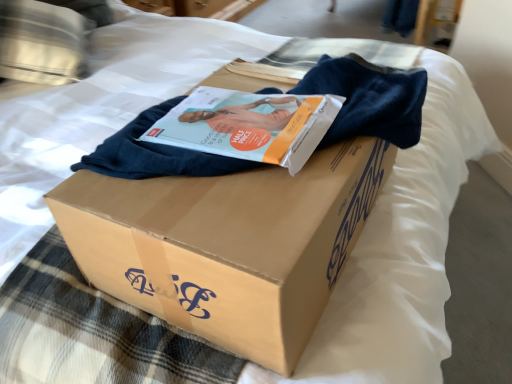
I want to click on matte paper magazine at center, so click(248, 125).

Is matte paper magazine at center completely or partially inside brown cardboard box at center?

Yes, matte paper magazine at center is inside brown cardboard box at center.

Is brown cardboard box at center to the right of matte paper magazine at center from the viewer's perspective?

Yes, brown cardboard box at center is to the right of matte paper magazine at center.

From the image's perspective, which one is positioned higher, brown cardboard box at center or matte paper magazine at center?

matte paper magazine at center.

Considering the points (57, 50) and (291, 326), which point is behind, point (57, 50) or point (291, 326)?

The point (57, 50) is behind.

Is the surface of metallic silver pillow at upper left in direct contact with brown cardboard box at center?

metallic silver pillow at upper left and brown cardboard box at center are clearly separated.

Between metallic silver pillow at upper left and brown cardboard box at center, which one has smaller size?

With smaller size is brown cardboard box at center.

I want to click on cardboard box above the metallic silver pillow at upper left (from a real-world perspective), so click(x=228, y=244).

Does metallic silver pillow at upper left have a greater height compared to matte paper magazine at center?

Yes, metallic silver pillow at upper left is taller than matte paper magazine at center.

Is metallic silver pillow at upper left not near matte paper magazine at center?

No, metallic silver pillow at upper left is in close proximity to matte paper magazine at center.

Can you tell me how much metallic silver pillow at upper left and matte paper magazine at center differ in facing direction?

They differ by 35.2 degrees in their facing directions.

From a real-world perspective, is matte paper magazine at center located higher than brown cardboard box at center?

Indeed, from a real-world perspective, matte paper magazine at center stands above brown cardboard box at center.

Where is `cardboard box on the right of matte paper magazine at center`? This screenshot has width=512, height=384. cardboard box on the right of matte paper magazine at center is located at coordinates (228, 244).

Is matte paper magazine at center not close to brown cardboard box at center?

No, there isn't a large distance between matte paper magazine at center and brown cardboard box at center.

From the image's perspective, which is above, matte paper magazine at center or brown cardboard box at center?

matte paper magazine at center appears higher in the image.

From the image's perspective, is matte paper magazine at center above or below metallic silver pillow at upper left?

From the image's perspective, matte paper magazine at center appears below metallic silver pillow at upper left.

What's the angular difference between matte paper magazine at center and metallic silver pillow at upper left's facing directions?

The angle between the facing direction of matte paper magazine at center and the facing direction of metallic silver pillow at upper left is 35.2 degrees.

Does matte paper magazine at center come behind metallic silver pillow at upper left?

No, matte paper magazine at center is in front of metallic silver pillow at upper left.

Is matte paper magazine at center aimed at metallic silver pillow at upper left?

No, matte paper magazine at center is not turned towards metallic silver pillow at upper left.

Does brown cardboard box at center have a greater width compared to metallic silver pillow at upper left?

In fact, brown cardboard box at center might be narrower than metallic silver pillow at upper left.

Who is taller, brown cardboard box at center or metallic silver pillow at upper left?

Standing taller between the two is metallic silver pillow at upper left.

Does point (176, 304) appear closer or farther from the camera than point (27, 46)?

Point (176, 304) is positioned closer to the camera compared to point (27, 46).

Do you think brown cardboard box at center is within metallic silver pillow at upper left, or outside of it?

brown cardboard box at center lies outside metallic silver pillow at upper left.

In order to click on magazine behind the brown cardboard box at center in this screenshot , I will do `click(248, 125)`.

Find the location of a particular element. This screenshot has height=384, width=512. cardboard box on the right of metallic silver pillow at upper left is located at coordinates (228, 244).

Estimate the real-world distances between objects in this image. Which object is further from brown cardboard box at center, matte paper magazine at center or metallic silver pillow at upper left?

Among the two, metallic silver pillow at upper left is located further to brown cardboard box at center.

When comparing their distances from matte paper magazine at center, does brown cardboard box at center or metallic silver pillow at upper left seem further?

Among the two, metallic silver pillow at upper left is located further to matte paper magazine at center.

Which object lies nearer to the anchor point metallic silver pillow at upper left, matte paper magazine at center or brown cardboard box at center?

matte paper magazine at center lies closer to metallic silver pillow at upper left than the other object.

When comparing their distances from metallic silver pillow at upper left, does brown cardboard box at center or matte paper magazine at center seem further?

brown cardboard box at center lies further to metallic silver pillow at upper left than the other object.

Which object lies further to the anchor point brown cardboard box at center, metallic silver pillow at upper left or matte paper magazine at center?

metallic silver pillow at upper left lies further to brown cardboard box at center than the other object.

Which object lies nearer to the anchor point matte paper magazine at center, metallic silver pillow at upper left or brown cardboard box at center?

brown cardboard box at center is closer to matte paper magazine at center.

The image size is (512, 384). In order to click on magazine between metallic silver pillow at upper left and brown cardboard box at center in the horizontal direction in this screenshot , I will do `click(248, 125)`.